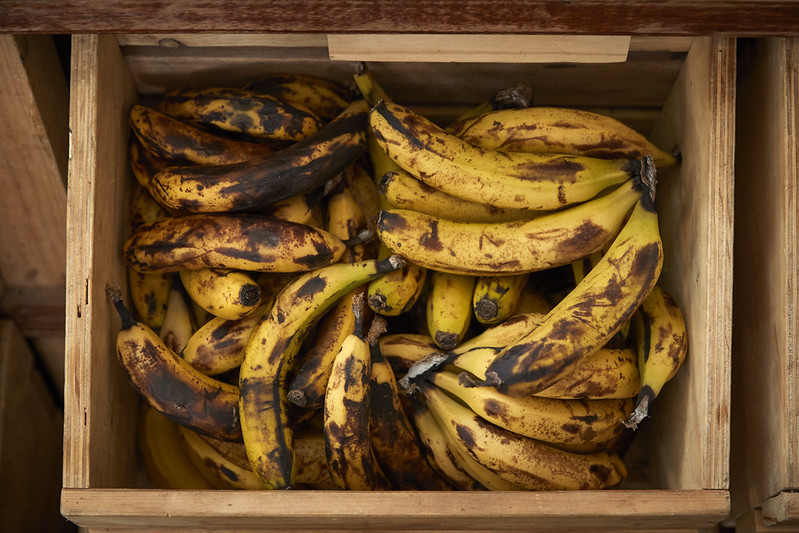
Where is `inside of crate`? The height and width of the screenshot is (533, 799). inside of crate is located at coordinates (455, 82).